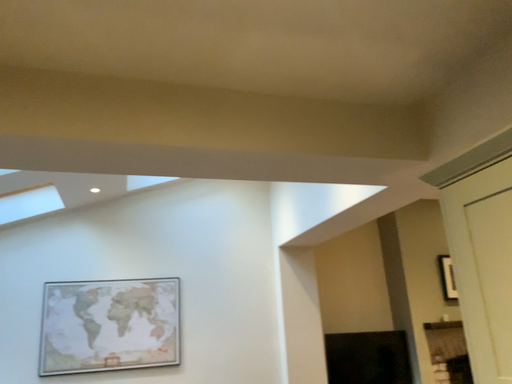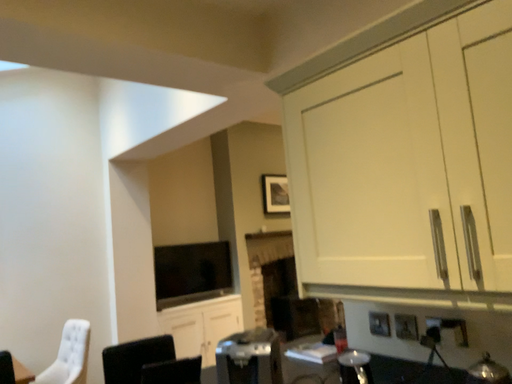
Question: Which way did the camera rotate in the video?

Choices:
 (A) rotated right
 (B) rotated left

Answer: (A)